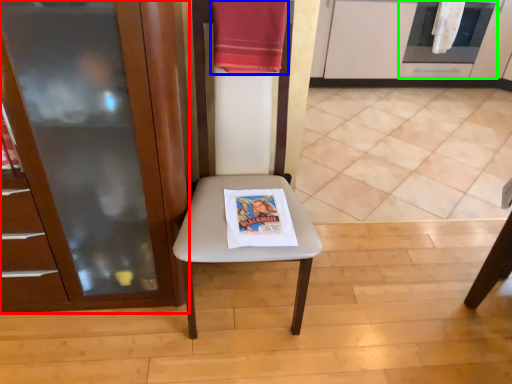
Question: Considering the real-world distances, which object is farthest from cabinetry (highlighted by a red box)? beach towel (highlighted by a blue box) or oven (highlighted by a green box)?

Choices:
 (A) beach towel
 (B) oven

Answer: (B)